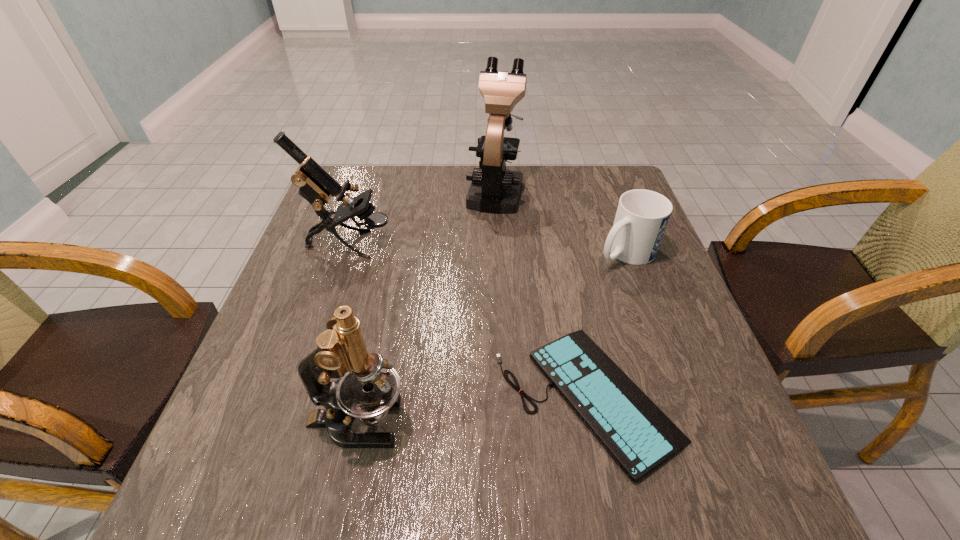
At what (x,y) coordinates should I click in order to perform the action: click on vacant region located on the left of the computer keyboard. Please return your answer as a coordinate pair (x, y). This screenshot has width=960, height=540. Looking at the image, I should click on click(x=320, y=396).

At what (x,y) coordinates should I click in order to perform the action: click on object situated at the far edge. Please return your answer as a coordinate pair (x, y). The image size is (960, 540). Looking at the image, I should click on (494, 189).

Where is `object present at the near edge`? object present at the near edge is located at coordinates (636, 433).

Where is `mug that is at the right edge`? The image size is (960, 540). mug that is at the right edge is located at coordinates (642, 216).

You are a GUI agent. You are given a task and a screenshot of the screen. Output one action in this format:
    pyautogui.click(x=<x>, y=<y>)
    Task: Click on the computer keyboard that is positioned at the right edge
    This screenshot has width=960, height=540.
    Given the screenshot: What is the action you would take?
    pyautogui.click(x=636, y=433)

What are the coordinates of `object located at the near right corner` in the screenshot? It's located at (636, 433).

In the image, there is a desktop. Where is `vacant area at the far edge`? vacant area at the far edge is located at coordinates click(419, 197).

In the image, there is a desktop. At what (x,y) coordinates should I click in order to perform the action: click on vacant region at the near edge. Please return your answer as a coordinate pair (x, y). Looking at the image, I should click on click(428, 484).

Locate an element on the screen. vacant space at the left edge is located at coordinates (320, 297).

The width and height of the screenshot is (960, 540). Find the location of `vacant region at the right edge of the desktop`. vacant region at the right edge of the desktop is located at coordinates (694, 388).